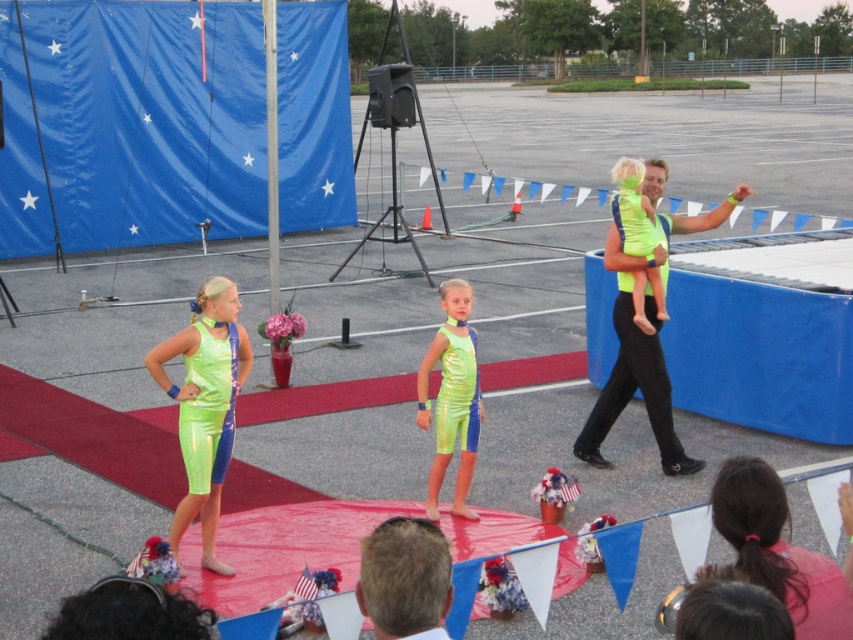
How far apart are blue fabric flag at upper left and neon green spandex at center?

blue fabric flag at upper left is 43.71 feet from neon green spandex at center.

Is blue fabric flag at upper left taller than neon green spandex at center?

Correct, blue fabric flag at upper left is much taller as neon green spandex at center.

Identify the location of blue fabric flag at upper left. This screenshot has width=853, height=640. (149, 120).

Does neon green shiny dress at center have a greater width compared to neon green fabric at right?

Yes, neon green shiny dress at center is wider than neon green fabric at right.

Is neon green shiny dress at center thinner than neon green fabric at right?

No, neon green shiny dress at center is not thinner than neon green fabric at right.

Which is in front, point (212, 378) or point (635, 220)?

Positioned in front is point (212, 378).

I want to click on neon green shiny dress at center, so click(x=207, y=406).

Does neon green spandex at center appear on the right side of neon green shiny dress at center?

Yes, neon green spandex at center is to the right of neon green shiny dress at center.

Between point (843, 580) and point (189, 417), which one is positioned in front?

Point (843, 580)

Locate an element on the screen. The width and height of the screenshot is (853, 640). neon green spandex at center is located at coordinates (778, 548).